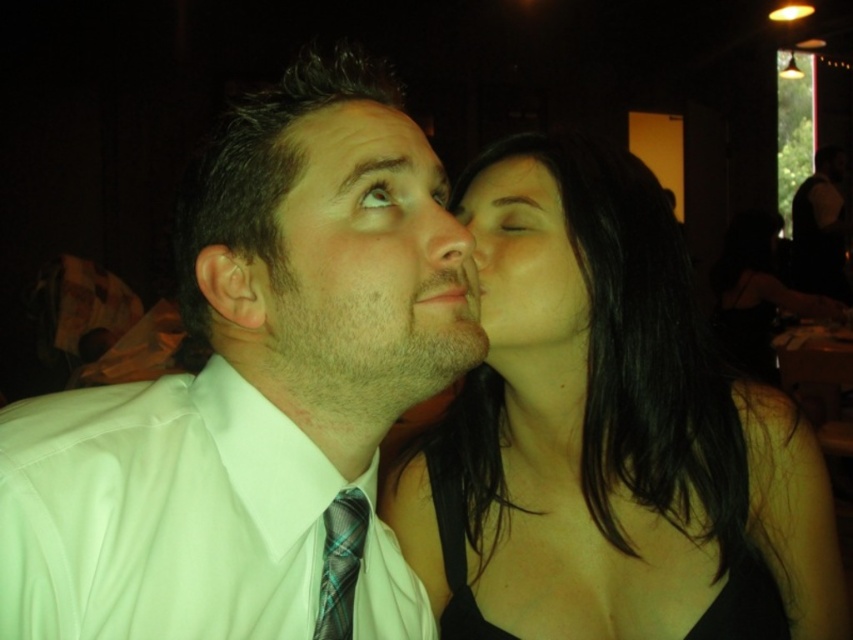
You are a photographer adjusting your camera to focus on the white shirt at center and the smooth skin face at center in the image. Which object should you focus on first if you want to capture both clearly in the same shot?

The white shirt at center is closer to the viewer than the smooth skin face at center, so you should focus on the white shirt at center first to ensure both are in focus.

You are a photographer adjusting the lighting for a portrait. You notice the white shirt at center and the smooth skin nose at center in your frame. Which object should you focus your spotlight on to ensure it is illuminated properly, considering their positions?

The white shirt at center is taller than the smooth skin nose at center, so you should focus the spotlight on the white shirt at center to ensure it is illuminated properly given its higher position.